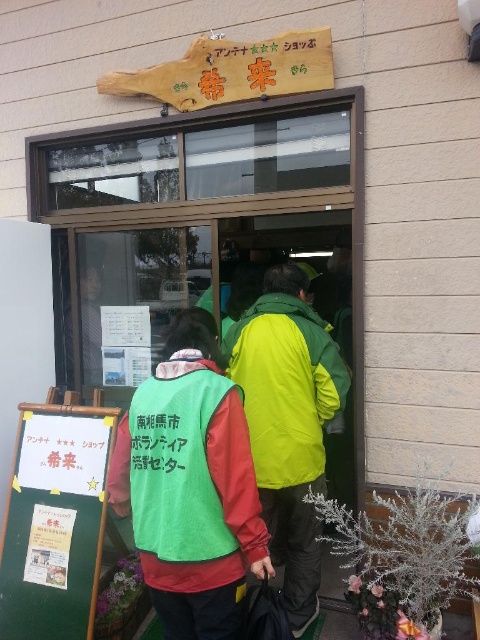
Question: Among these objects, which one is farthest from the camera?

Choices:
 (A) green fabric vest at center
 (B) green matte jacket at center
 (C) green fabric sign at center

Answer: (B)

Question: Among these objects, which one is nearest to the camera?

Choices:
 (A) green fabric vest at center
 (B) green matte jacket at center
 (C) green fabric sign at center

Answer: (A)

Question: Can you confirm if green matte jacket at center is wider than green fabric vest at center?

Choices:
 (A) no
 (B) yes

Answer: (A)

Question: Estimate the real-world distances between objects in this image. Which object is farther from the green matte jacket at center?

Choices:
 (A) green fabric sign at center
 (B) green fabric vest at center

Answer: (A)

Question: Is green fabric sign at center positioned in front of green matte jacket at center?

Choices:
 (A) yes
 (B) no

Answer: (A)

Question: Can you confirm if green fabric sign at center is positioned above green fabric vest at center?

Choices:
 (A) yes
 (B) no

Answer: (B)